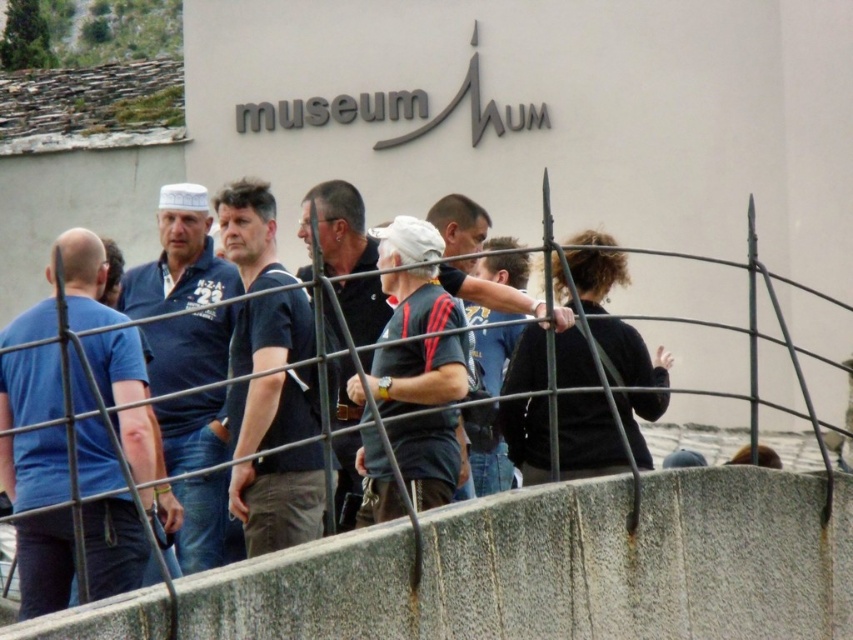
Is dark blue polo shirt at center shorter than dark gray fabric shirt at center?

No, dark blue polo shirt at center is not shorter than dark gray fabric shirt at center.

Who is positioned more to the right, dark blue polo shirt at center or dark gray fabric shirt at center?

From the viewer's perspective, dark gray fabric shirt at center appears more on the right side.

Who is more distant from viewer, [177,241] or [489,328]?

The point [177,241] is more distant.

Identify the location of dark blue polo shirt at center. The image size is (853, 640). point(178,259).

Measure the distance from dark gray sweater at center to matte black shirt at center.

7.33 meters

Is dark gray sweater at center to the right of matte black shirt at center from the viewer's perspective?

Yes, dark gray sweater at center is to the right of matte black shirt at center.

Image resolution: width=853 pixels, height=640 pixels. I want to click on dark gray sweater at center, so click(587, 436).

Is the position of gray concrete barrier at lower center more distant than that of dark blue shirt at center?

No, gray concrete barrier at lower center is closer to the viewer.

Can you confirm if gray concrete barrier at lower center is smaller than dark blue shirt at center?

Correct, gray concrete barrier at lower center occupies less space than dark blue shirt at center.

The height and width of the screenshot is (640, 853). Describe the element at coordinates (561, 566) in the screenshot. I see `gray concrete barrier at lower center` at that location.

Locate an element on the screen. Image resolution: width=853 pixels, height=640 pixels. gray concrete barrier at lower center is located at coordinates (561, 566).